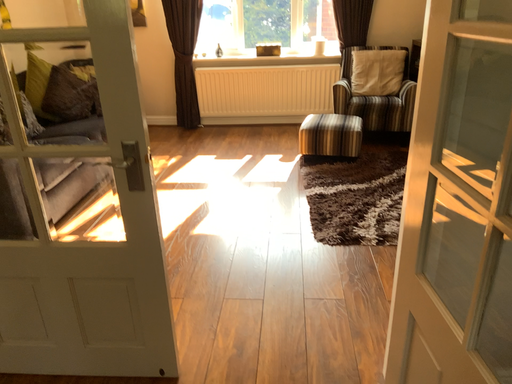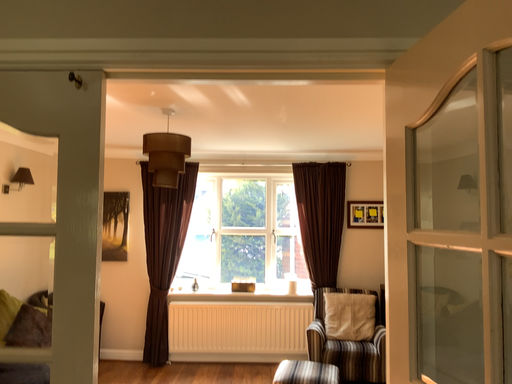
Question: Which way did the camera rotate in the video?

Choices:
 (A) rotated upward
 (B) rotated downward

Answer: (A)